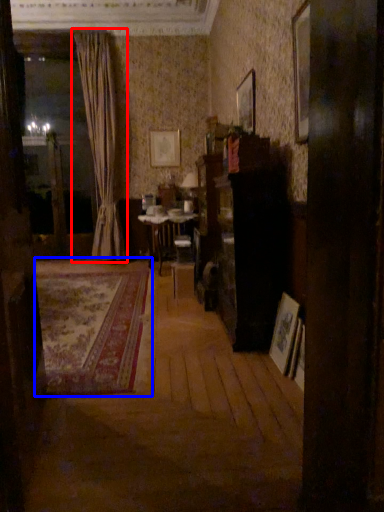
Question: Which point is closer to the camera, curtain (highlighted by a red box) or plain (highlighted by a blue box)?

Choices:
 (A) curtain
 (B) plain

Answer: (B)